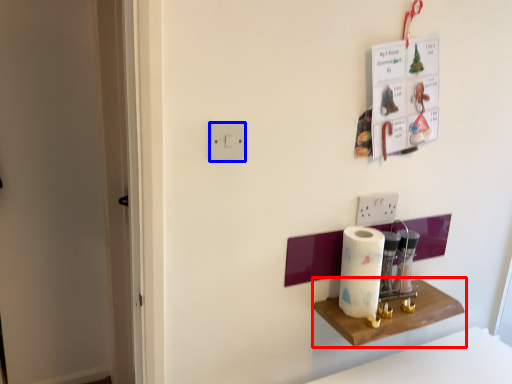
Question: Which object is closer to the camera taking this photo, shelf (highlighted by a red box) or light switch (highlighted by a blue box)?

Choices:
 (A) shelf
 (B) light switch

Answer: (B)